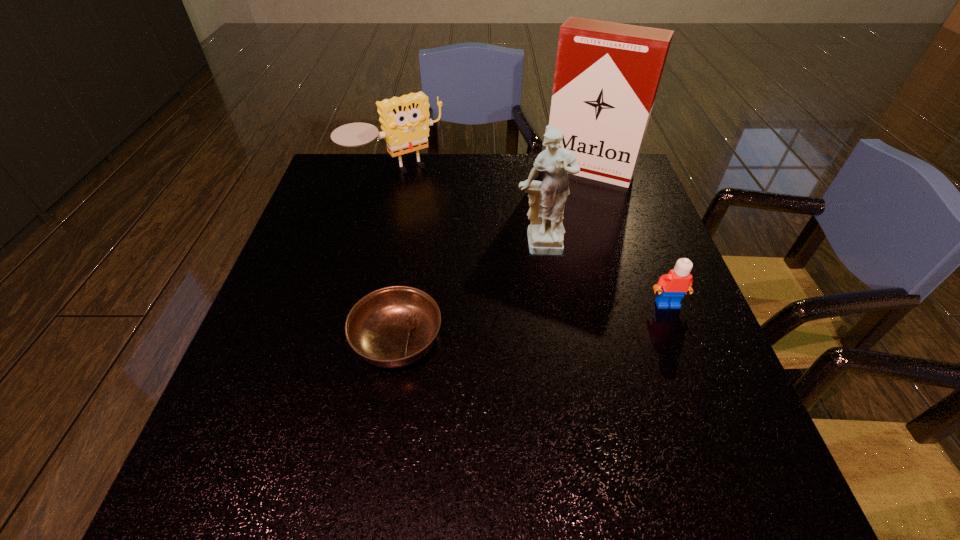
The width and height of the screenshot is (960, 540). Identify the location of Lego that is at the right edge. (677, 282).

Where is `cigarette_case present at the right edge`? Image resolution: width=960 pixels, height=540 pixels. cigarette_case present at the right edge is located at coordinates (607, 74).

You are a GUI agent. You are given a task and a screenshot of the screen. Output one action in this format:
    pyautogui.click(x=<x>, y=<y>)
    Task: Click on the object at the far left corner
    
    Given the screenshot: What is the action you would take?
    pyautogui.click(x=405, y=122)

Find the location of a particular element. The height and width of the screenshot is (540, 960). object positioned at the far right corner is located at coordinates (607, 74).

The image size is (960, 540). In the image, there is a desktop. Identify the location of free space at the far edge. (396, 184).

Where is `free space at the left edge`? This screenshot has height=540, width=960. free space at the left edge is located at coordinates (287, 270).

Locate an element on the screen. vacant area at the right edge of the desktop is located at coordinates pos(622,285).

Where is `vacant space at the far left corner`? vacant space at the far left corner is located at coordinates (364, 153).

Identify the location of vacant space at the near left corner of the desktop. The image size is (960, 540). (229, 396).

The height and width of the screenshot is (540, 960). I want to click on free space between the Lego and the shortest object, so click(x=532, y=322).